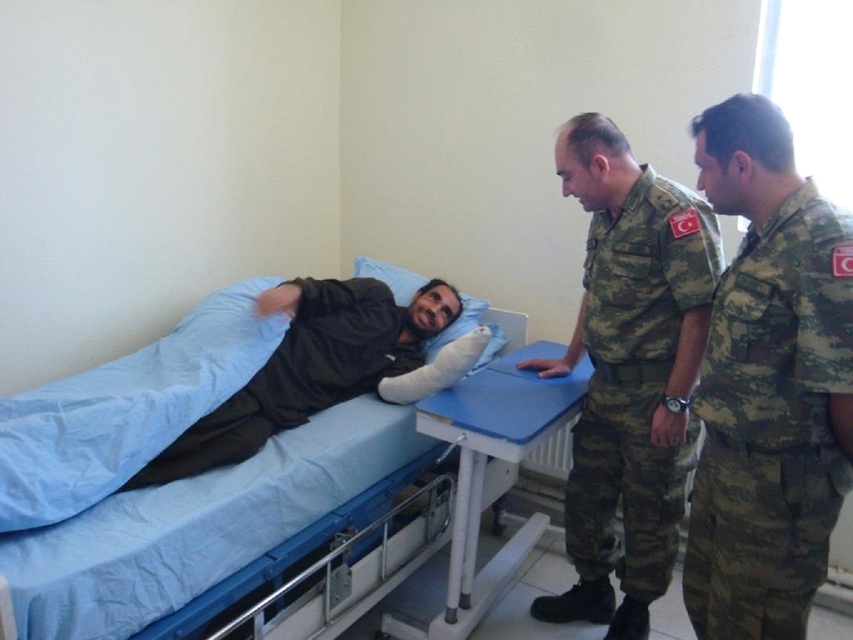
In the scene shown: Is white plastic table at center above blue fabric pillow at upper center?

No.

Does point (418, 429) lie in front of point (440, 332)?

Yes, it is.

You are a GUI agent. You are given a task and a screenshot of the screen. Output one action in this format:
    pyautogui.click(x=<x>, y=<y>)
    Task: Click on the white plastic table at center
    This screenshot has width=853, height=640.
    Given the screenshot: What is the action you would take?
    pyautogui.click(x=485, y=474)

Which is more to the right, blue fabric bed at center or white plastic table at center?

white plastic table at center

What do you see at coordinates (184, 538) in the screenshot? Image resolution: width=853 pixels, height=640 pixels. I see `blue fabric bed at center` at bounding box center [184, 538].

You are a GUI agent. You are given a task and a screenshot of the screen. Output one action in this format:
    pyautogui.click(x=<x>, y=<y>)
    Task: Click on the blue fabric bed at center
    
    Given the screenshot: What is the action you would take?
    pyautogui.click(x=184, y=538)

Is blue fabric bed at center above blue fabric pillow at upper center?

Actually, blue fabric bed at center is below blue fabric pillow at upper center.

Find the location of a particular element. blue fabric bed at center is located at coordinates (184, 538).

Image resolution: width=853 pixels, height=640 pixels. I want to click on blue fabric bed at center, so [x=184, y=538].